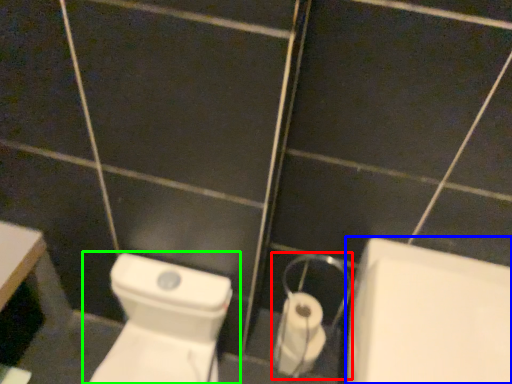
Question: Estimate the real-world distances between objects in this image. Which object is farther from dispenser (highlighted by a red box), bath (highlighted by a blue box) or toilet (highlighted by a green box)?

Choices:
 (A) bath
 (B) toilet

Answer: (B)